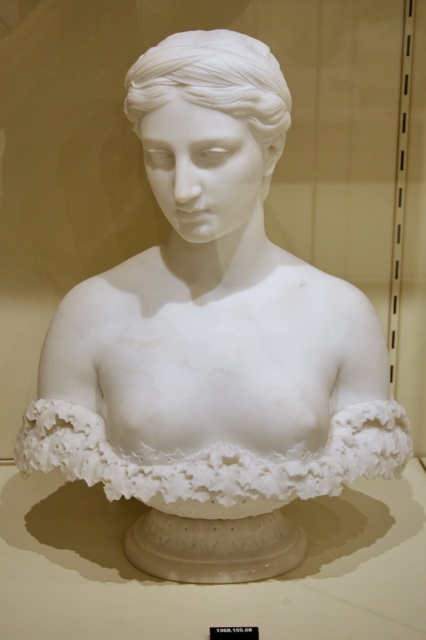
Question: Which of the following is the farthest from the observer?

Choices:
 (A) (213, 486)
 (B) (250, 112)

Answer: (A)

Question: Which point appears closest to the camera in this image?

Choices:
 (A) (152, 67)
 (B) (408, 432)

Answer: (A)

Question: Which point is farther to the camera?

Choices:
 (A) (284, 116)
 (B) (376, 451)

Answer: (B)

Question: In this image, where is white marble ruffle at center located relative to white marble bust at center?

Choices:
 (A) below
 (B) above

Answer: (A)

Question: Is white marble ruffle at center above white marble bust at center?

Choices:
 (A) no
 (B) yes

Answer: (A)

Question: Does white marble ruffle at center have a greater width compared to white marble bust at center?

Choices:
 (A) no
 (B) yes

Answer: (B)